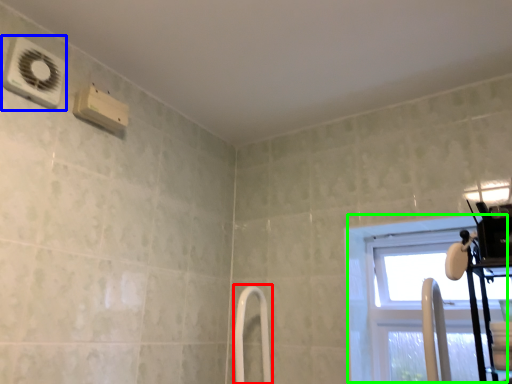
Question: Considering the real-world distances, which object is closest to shower door (highlighted by a red box)? air conditioning (highlighted by a blue box) or window (highlighted by a green box).

Choices:
 (A) air conditioning
 (B) window

Answer: (B)